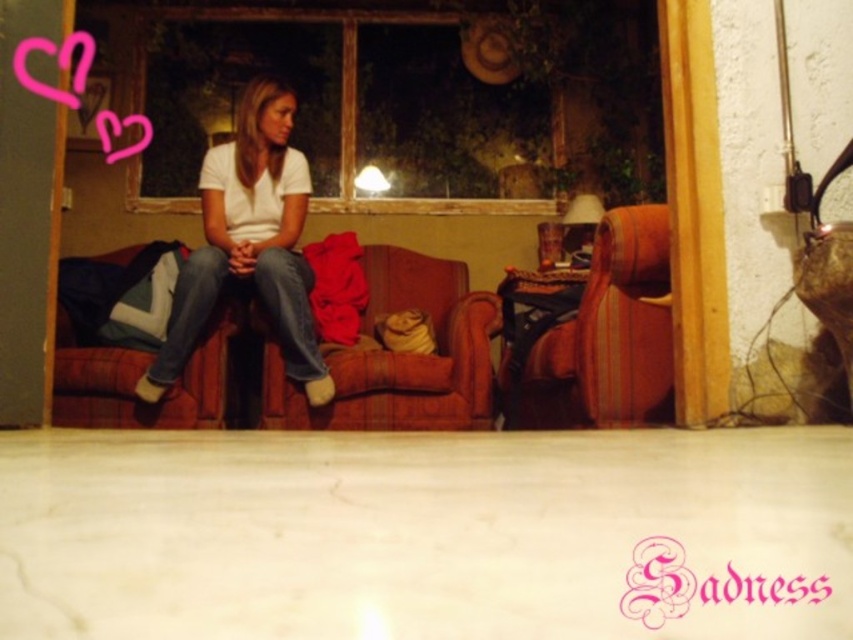
Looking at this image, who is more distant from viewer, (288, 404) or (234, 176)?

The point (234, 176) is behind.

Which is above, velvet-like brown couch at center or white matte shirt at center?

white matte shirt at center

Is point (64, 380) closer to camera compared to point (286, 198)?

Yes, it is.

This screenshot has height=640, width=853. Identify the location of velvet-like brown couch at center. (326, 358).

Does velvet-like brown couch at center have a lesser width compared to brown leather armchair at right?

In fact, velvet-like brown couch at center might be wider than brown leather armchair at right.

Which is in front, point (57, 353) or point (582, 401)?

Point (582, 401) is in front.

Find the location of a particular element. velvet-like brown couch at center is located at coordinates (326, 358).

Is white matte shirt at center behind brown leather armchair at right?

Yes, white matte shirt at center is behind brown leather armchair at right.

Does white matte shirt at center appear under brown leather armchair at right?

Actually, white matte shirt at center is above brown leather armchair at right.

Is point (318, 403) more distant than point (573, 378)?

Yes, point (318, 403) is farther from viewer.

Where is `white matte shirt at center`? This screenshot has width=853, height=640. white matte shirt at center is located at coordinates (248, 243).